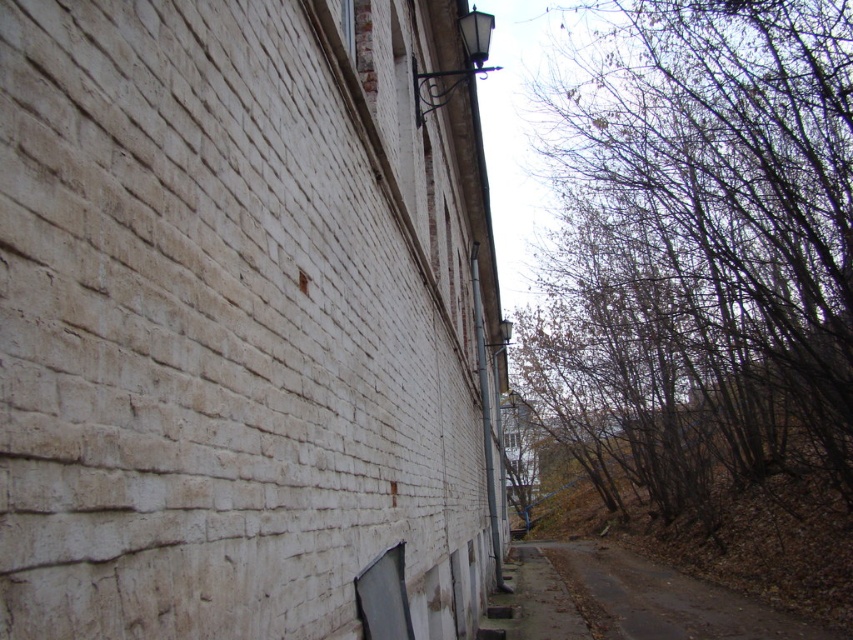
Can you confirm if brown leafless trees at upper right is smaller than brown dirt road at lower right?

No.

What do you see at coordinates (721, 212) in the screenshot?
I see `brown leafless trees at upper right` at bounding box center [721, 212].

Is point (804, 324) positioned before point (750, 634)?

No.

Identify the location of brown leafless trees at upper right. The image size is (853, 640). (721, 212).